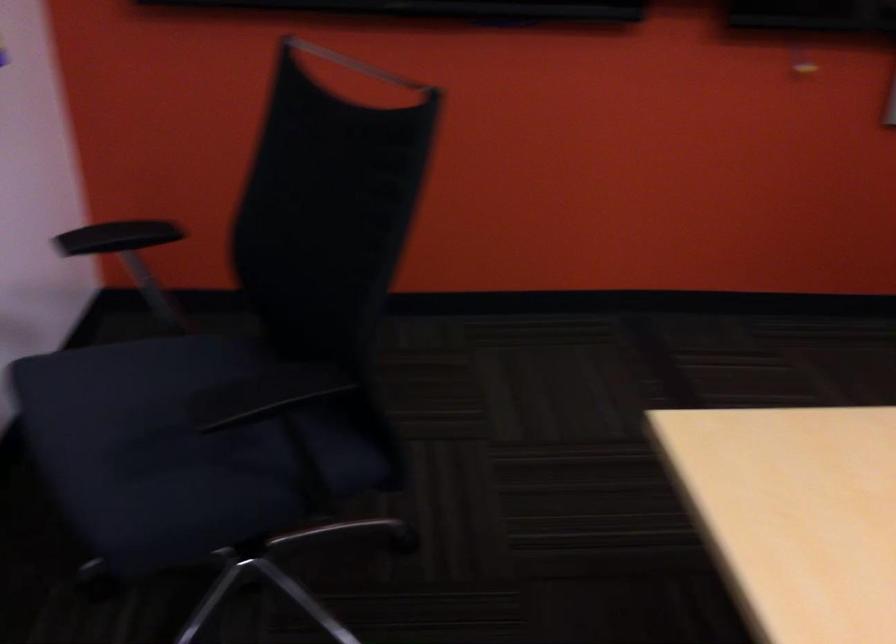
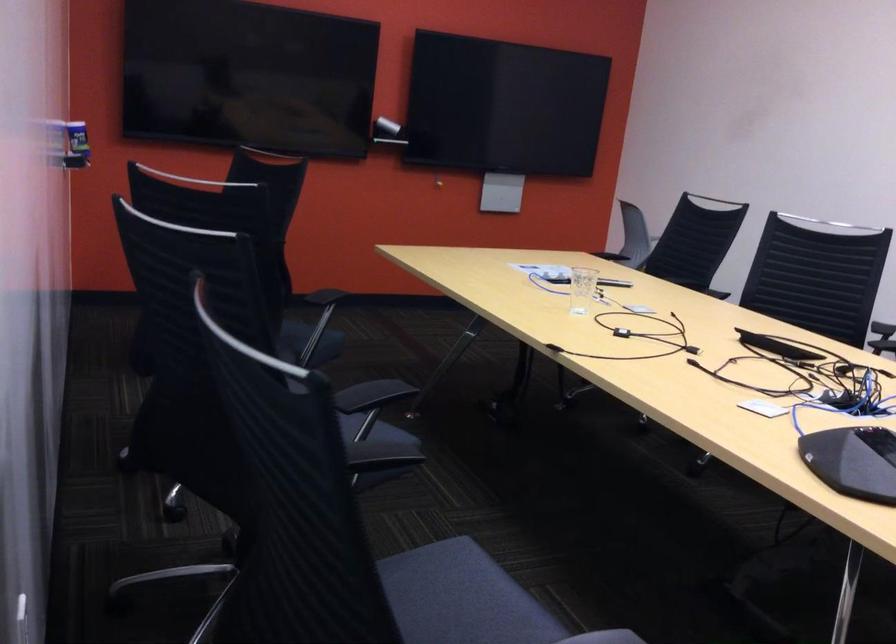
Question: I am providing you with two images of the same scene from different viewpoints. Which of the following objects are not visible in image2?

Choices:
 (A) black chair sitting surface
 (B) blue spray can
 (C) black chair armrest
 (D) pink cactus pot

Answer: (C)